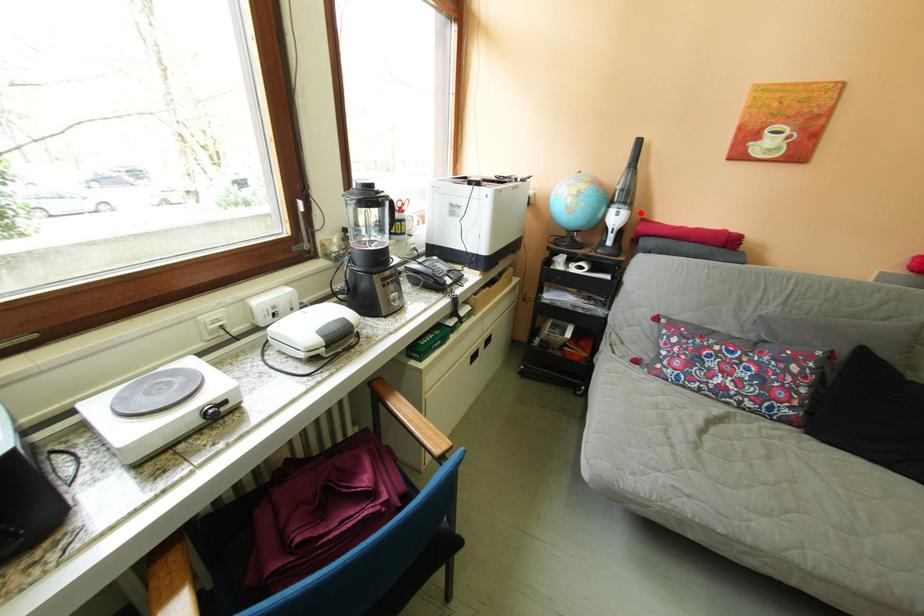
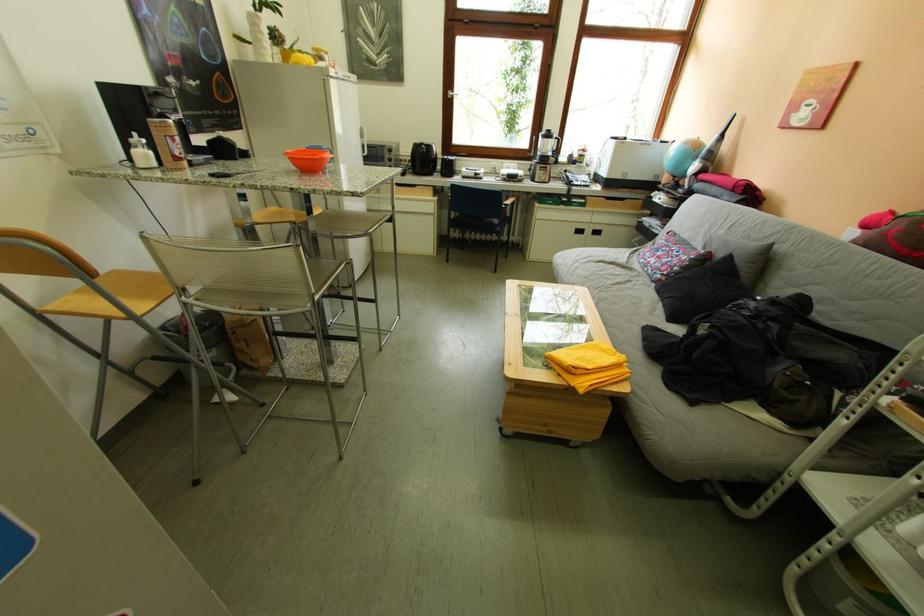
Find the pixel in the second image that matches the highlighted location in the first image.

(713, 166)